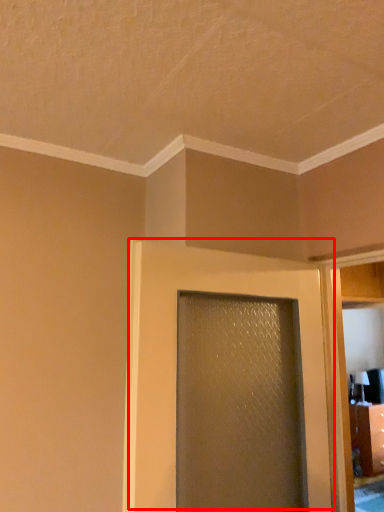
Question: From the image, what is the correct spatial relationship of door (annotated by the red box) in relation to elevator?

Choices:
 (A) right
 (B) left

Answer: (B)